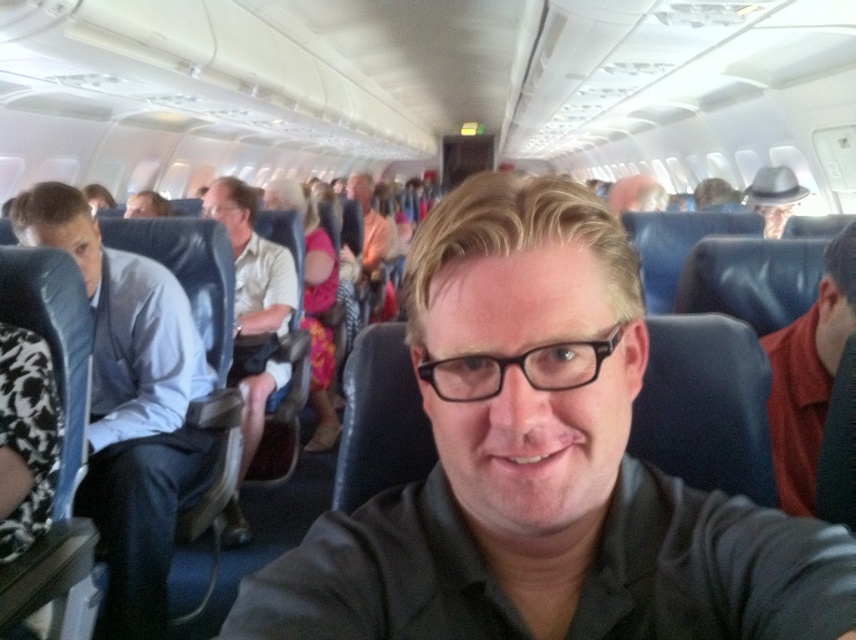
Is black matte shirt at center to the right of matte black hat at upper center from the viewer's perspective?

No, black matte shirt at center is not to the right of matte black hat at upper center.

Is point (590, 433) closer to camera compared to point (631, 202)?

Yes.

Where is `black matte shirt at center`? Image resolution: width=856 pixels, height=640 pixels. black matte shirt at center is located at coordinates (542, 467).

The height and width of the screenshot is (640, 856). I want to click on black matte shirt at center, so click(x=542, y=467).

I want to click on black matte shirt at center, so click(x=542, y=467).

Between black matte shirt at center and matte gray hat at upper right, which one has less height?

A: With less height is black matte shirt at center.

You are a GUI agent. You are given a task and a screenshot of the screen. Output one action in this format:
    pyautogui.click(x=<x>, y=<y>)
    Task: Click on the black matte shirt at center
    The image size is (856, 640).
    Given the screenshot: What is the action you would take?
    pyautogui.click(x=542, y=467)

Find the location of `black matte shirt at center`. black matte shirt at center is located at coordinates coord(542,467).